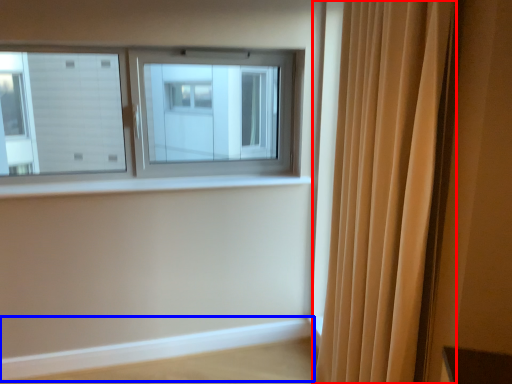
Question: Which object is closer to the camera taking this photo, curtain (highlighted by a red box) or ledge (highlighted by a blue box)?

Choices:
 (A) curtain
 (B) ledge

Answer: (A)